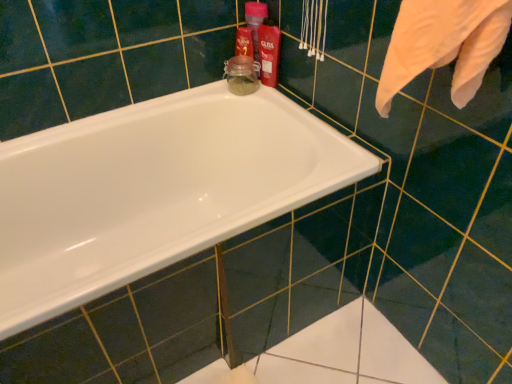
Question: Is shiny red plastic bottle at upper right, which ranks as the first cleaning product in front-to-back order, bigger or smaller than matte plastic bottle at upper right, the 2th cleaning product when ordered from front to back?

Choices:
 (A) small
 (B) big

Answer: (A)

Question: Is point (278, 67) closer or farther from the camera than point (252, 6)?

Choices:
 (A) farther
 (B) closer

Answer: (A)

Question: Considering the real-world distances, which object is closest to the shiny red plastic bottle at upper right, the second cleaning product positioned from the back?

Choices:
 (A) white glossy bathtub at center
 (B) matte plastic bottle at upper right, the first cleaning product in the back-to-front sequence

Answer: (B)

Question: Which object is the closest to the shiny red plastic bottle at upper right, the second cleaning product positioned from the back?

Choices:
 (A) matte plastic bottle at upper right, the first cleaning product in the back-to-front sequence
 (B) white glossy bathtub at center

Answer: (A)